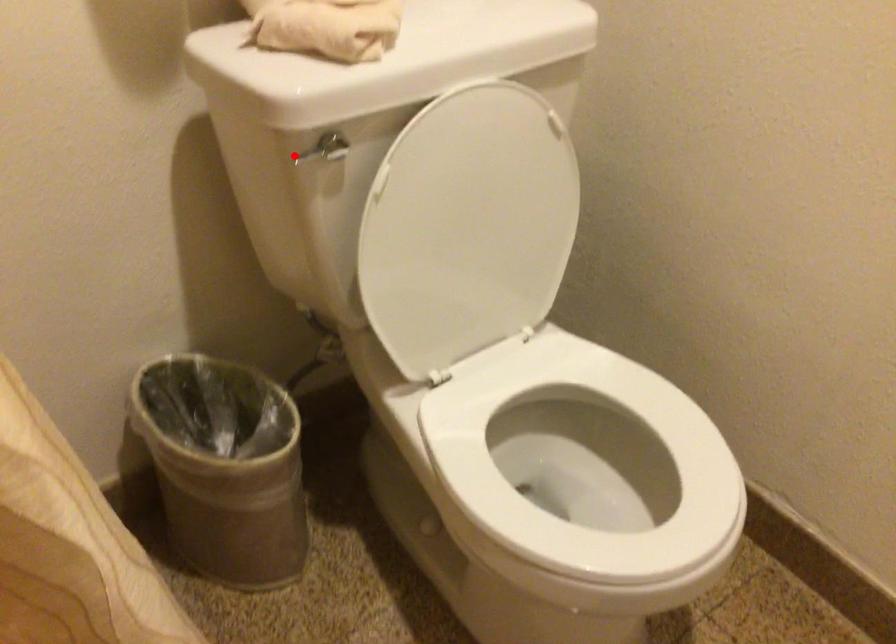
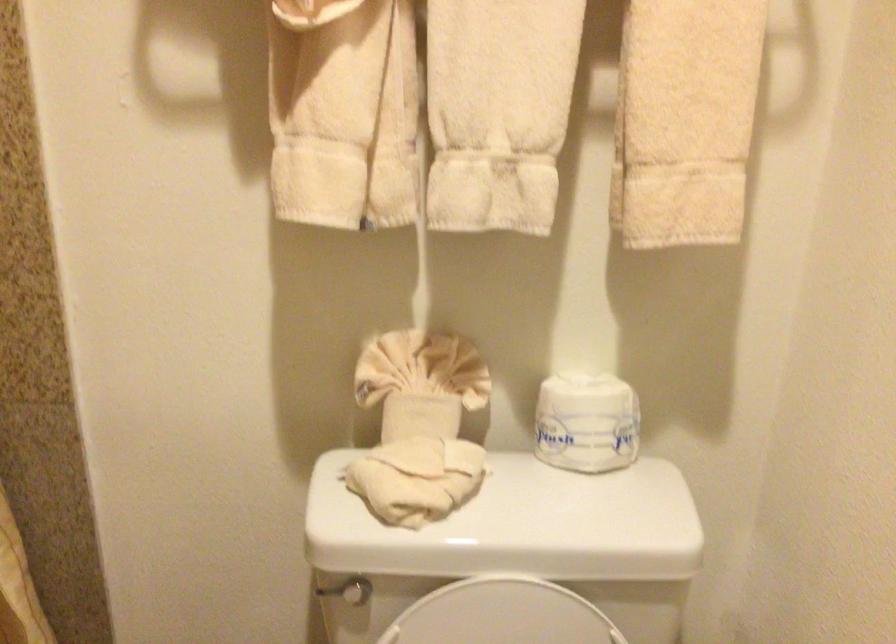
Locate, in the second image, the point that corresponds to the highlighted location in the first image.

(326, 590)